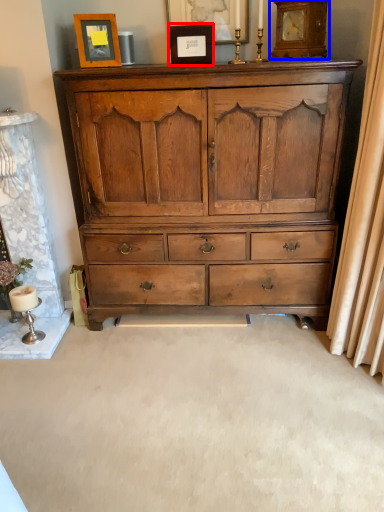
Question: Which object appears closest to the camera in this image, picture frame (highlighted by a red box) or clock (highlighted by a blue box)?

Choices:
 (A) picture frame
 (B) clock

Answer: (B)